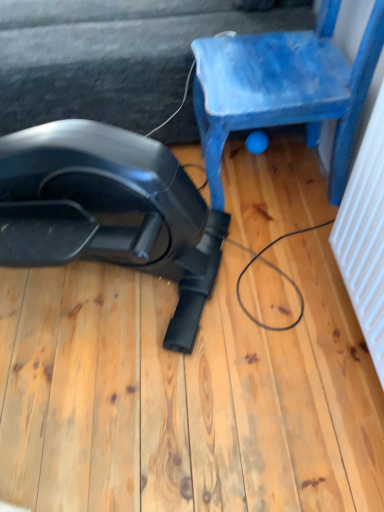
What do you see at coordinates (108, 59) in the screenshot?
I see `black plastic vacuum cleaner at lower left` at bounding box center [108, 59].

What is the approximate height of blue painted wood chair at upper right?

28.58 inches.

Find the location of a particular element. black plastic vacuum cleaner at lower left is located at coordinates (108, 59).

Looking at this image, which of these two, black rubber vacuum cleaner at lower left or blue painted wood chair at upper right, is wider?

Wider between the two is black rubber vacuum cleaner at lower left.

From the picture: Which of these two, black rubber vacuum cleaner at lower left or blue painted wood chair at upper right, stands taller?

black rubber vacuum cleaner at lower left.

Consider the image. Considering the relative positions of black rubber vacuum cleaner at lower left and blue painted wood chair at upper right in the image provided, is black rubber vacuum cleaner at lower left to the left or to the right of blue painted wood chair at upper right?

black rubber vacuum cleaner at lower left is positioned on blue painted wood chair at upper right's left side.

Does point (11, 199) lie behind point (294, 72)?

No, (11, 199) is closer to viewer.

I want to click on surface that appears behind the black rubber vacuum cleaner at lower left, so click(x=108, y=59).

Is black plastic vacuum cleaner at lower left next to black rubber vacuum cleaner at lower left?

black plastic vacuum cleaner at lower left is not next to black rubber vacuum cleaner at lower left, and they're not touching.

Is black plastic vacuum cleaner at lower left bigger or smaller than black rubber vacuum cleaner at lower left?

Considering their sizes, black plastic vacuum cleaner at lower left takes up more space than black rubber vacuum cleaner at lower left.

How many degrees apart are the facing directions of black plastic vacuum cleaner at lower left and black rubber vacuum cleaner at lower left?

The facing directions of black plastic vacuum cleaner at lower left and black rubber vacuum cleaner at lower left are 20.3 degrees apart.

From the image's perspective, does blue painted wood chair at upper right appear lower than black plastic vacuum cleaner at lower left?

Yes, from the image's perspective, blue painted wood chair at upper right is beneath black plastic vacuum cleaner at lower left.

Can you confirm if blue painted wood chair at upper right is bigger than black plastic vacuum cleaner at lower left?

No.

Is blue painted wood chair at upper right not close to black plastic vacuum cleaner at lower left?

That's not correct — blue painted wood chair at upper right is a little close to black plastic vacuum cleaner at lower left.

Which is less distant, (227, 94) or (103, 100)?

The point (227, 94) is closer.

At what (x,y) coordinates should I click in order to perform the action: click on equipment in front of the blue painted wood chair at upper right. Please return your answer as a coordinate pair (x, y). The height and width of the screenshot is (512, 384). Looking at the image, I should click on (109, 211).

Is black rubber vacuum cleaner at lower left surrounded by blue painted wood chair at upper right?

Definitely not — black rubber vacuum cleaner at lower left is not inside blue painted wood chair at upper right.

Between blue painted wood chair at upper right and black rubber vacuum cleaner at lower left, which one is positioned in front?

black rubber vacuum cleaner at lower left.

How much distance is there between blue painted wood chair at upper right and black rubber vacuum cleaner at lower left?

They are 16.17 inches apart.

What's the angular difference between black rubber vacuum cleaner at lower left and black plastic vacuum cleaner at lower left's facing directions?

black rubber vacuum cleaner at lower left and black plastic vacuum cleaner at lower left are facing 20.3 degrees away from each other.

Does black rubber vacuum cleaner at lower left appear on the left side of black plastic vacuum cleaner at lower left?

Indeed, black rubber vacuum cleaner at lower left is positioned on the left side of black plastic vacuum cleaner at lower left.

Which is correct: black rubber vacuum cleaner at lower left is inside black plastic vacuum cleaner at lower left, or outside of it?

The correct answer is: outside.

Which of these two, black rubber vacuum cleaner at lower left or black plastic vacuum cleaner at lower left, is thinner?

With smaller width is black rubber vacuum cleaner at lower left.

Identify the location of chair on the right of black plastic vacuum cleaner at lower left. (283, 88).

From a real-world perspective, is black plastic vacuum cleaner at lower left located higher than blue painted wood chair at upper right?

No, from a real-world perspective, black plastic vacuum cleaner at lower left is not on top of blue painted wood chair at upper right.

Is black plastic vacuum cleaner at lower left not inside blue painted wood chair at upper right?

Yes, black plastic vacuum cleaner at lower left is located beyond the bounds of blue painted wood chair at upper right.

Is point (130, 39) farther from camera compared to point (219, 145)?

Yes, point (130, 39) is farther from viewer.

At what (x,y) coordinates should I click in order to perform the action: click on equipment above the blue painted wood chair at upper right (from a real-world perspective). Please return your answer as a coordinate pair (x, y). This screenshot has height=512, width=384. Looking at the image, I should click on coord(109,211).

Identify the location of equipment lying in front of the black plastic vacuum cleaner at lower left. (109, 211).

Based on their spatial positions, is black rubber vacuum cleaner at lower left or black plastic vacuum cleaner at lower left further from blue painted wood chair at upper right?

black rubber vacuum cleaner at lower left lies further to blue painted wood chair at upper right than the other object.

From the image, which object appears to be nearer to black plastic vacuum cleaner at lower left, black rubber vacuum cleaner at lower left or blue painted wood chair at upper right?

blue painted wood chair at upper right is closer to black plastic vacuum cleaner at lower left.

Looking at this image, from the image, which object appears to be farther from black rubber vacuum cleaner at lower left, black plastic vacuum cleaner at lower left or blue painted wood chair at upper right?

Among the two, black plastic vacuum cleaner at lower left is located further to black rubber vacuum cleaner at lower left.

Based on their spatial positions, is blue painted wood chair at upper right or black rubber vacuum cleaner at lower left closer to black plastic vacuum cleaner at lower left?

blue painted wood chair at upper right lies closer to black plastic vacuum cleaner at lower left than the other object.

Based on their spatial positions, is black plastic vacuum cleaner at lower left or black rubber vacuum cleaner at lower left further from blue painted wood chair at upper right?

black rubber vacuum cleaner at lower left is positioned further to the anchor blue painted wood chair at upper right.

When comparing their distances from black rubber vacuum cleaner at lower left, does blue painted wood chair at upper right or black plastic vacuum cleaner at lower left seem closer?

The object closer to black rubber vacuum cleaner at lower left is blue painted wood chair at upper right.

At what (x,y) coordinates should I click in order to perform the action: click on chair between black rubber vacuum cleaner at lower left and black plastic vacuum cleaner at lower left from front to back. Please return your answer as a coordinate pair (x, y). Looking at the image, I should click on (283, 88).